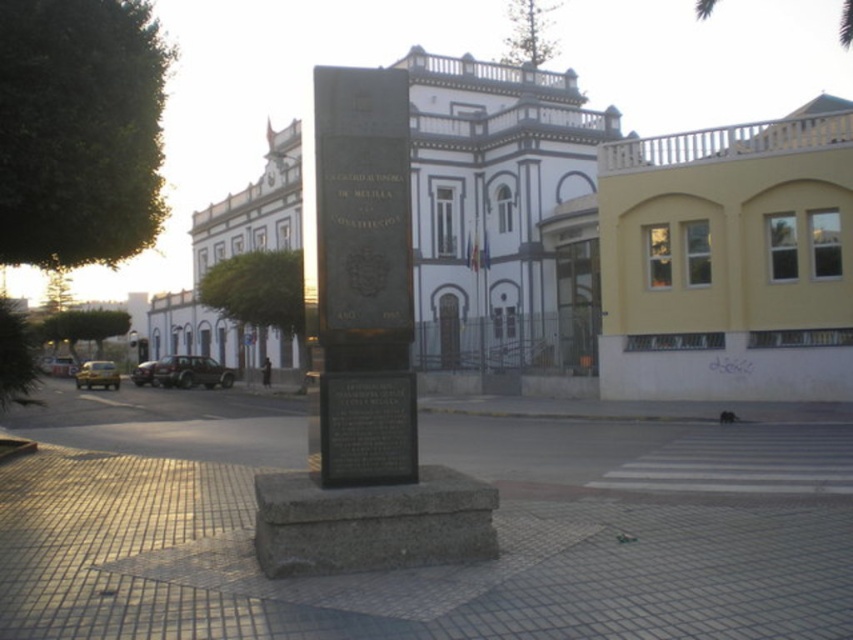
From the picture: You are a tourist standing in the plaza and want to take a photo of the black stone plaque at center without the green leafy palm tree at upper center blocking the view. Is it possible to do so?

The black stone plaque at center is below the green leafy palm tree at upper center, so if you position yourself directly in front of the plaque, the palm tree will be above it in the frame and not block the view of the plaque itself.